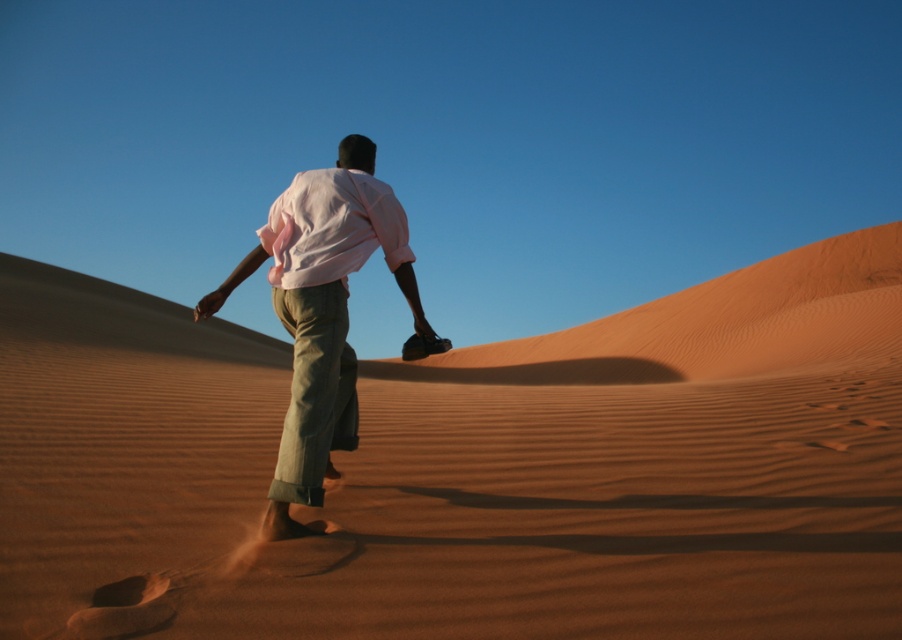
Question: Is smooth sand at center further to the viewer compared to pink cotton shirt at center?

Choices:
 (A) no
 (B) yes

Answer: (A)

Question: Among these objects, which one is farthest from the camera?

Choices:
 (A) smooth sand at center
 (B) pink cotton shirt at center

Answer: (B)

Question: Where is smooth sand at center located in relation to pink cotton shirt at center in the image?

Choices:
 (A) left
 (B) right

Answer: (B)

Question: Which point is farther to the camera?

Choices:
 (A) (356, 400)
 (B) (651, 596)

Answer: (A)

Question: Can you confirm if smooth sand at center is positioned below pink cotton shirt at center?

Choices:
 (A) no
 (B) yes

Answer: (B)